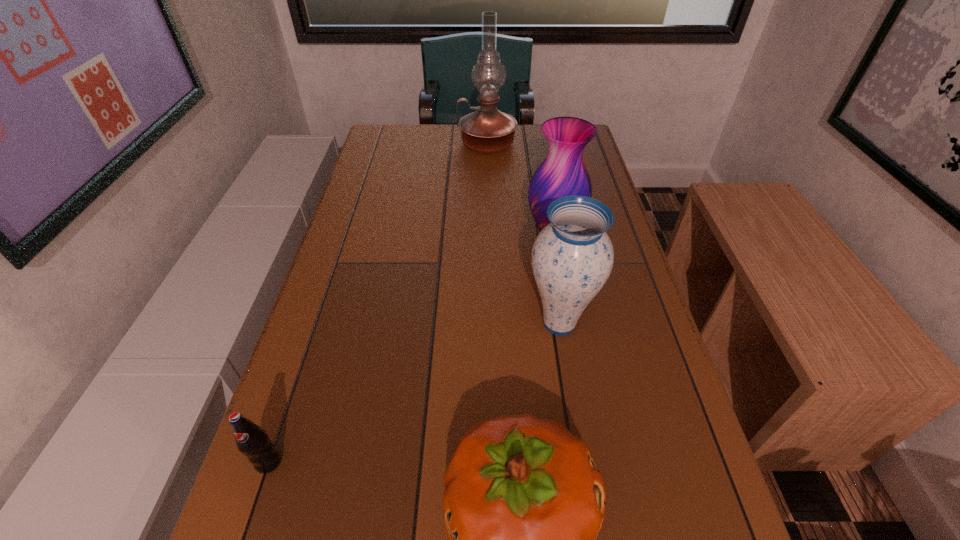
Locate an element on the screen. oil lamp is located at coordinates (487, 130).

The height and width of the screenshot is (540, 960). I want to click on the farthest object, so tap(487, 130).

Where is `the fourth nearest object`? The height and width of the screenshot is (540, 960). the fourth nearest object is located at coordinates (563, 173).

Locate an element on the screen. the nearer vase is located at coordinates (572, 257).

Find the location of `the leftmost object`. the leftmost object is located at coordinates (252, 441).

Locate an element on the screen. the shortest object is located at coordinates (252, 441).

Where is `free space located 0.120m on the front of the farthest object`? The height and width of the screenshot is (540, 960). free space located 0.120m on the front of the farthest object is located at coordinates (488, 179).

Image resolution: width=960 pixels, height=540 pixels. Identify the location of vacant area situated on the left of the fourth nearest object. (488, 233).

The image size is (960, 540). In order to click on vacant space situated 0.110m on the front of the nearer vase in this screenshot , I will do `click(572, 400)`.

This screenshot has height=540, width=960. What are the coordinates of `free space located 0.050m on the front label of the shortest object` in the screenshot? It's located at (253, 507).